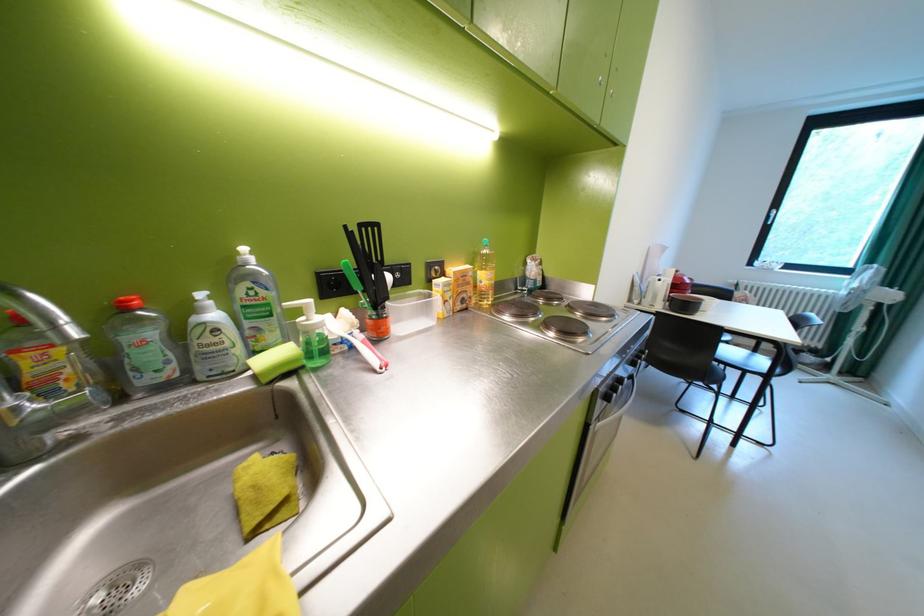
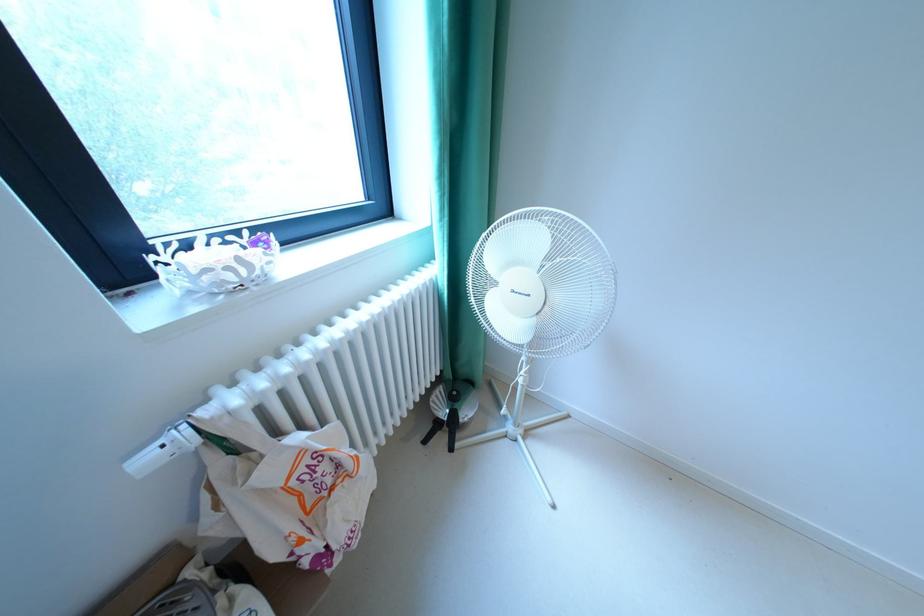
Locate, in the second image, the point that corresponds to the point at 739,282 in the first image.

(156, 460)